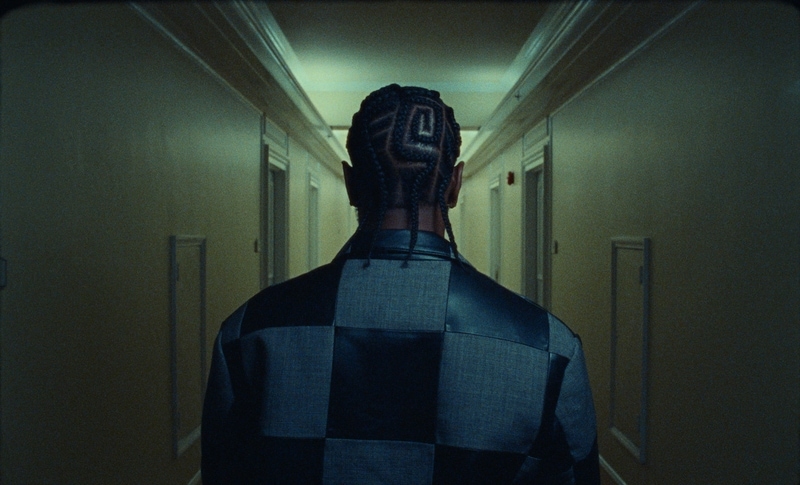
The image size is (800, 485). Identify the location of leather fabric. (421, 242), (486, 300), (368, 386), (293, 308), (294, 456), (473, 468), (556, 385).